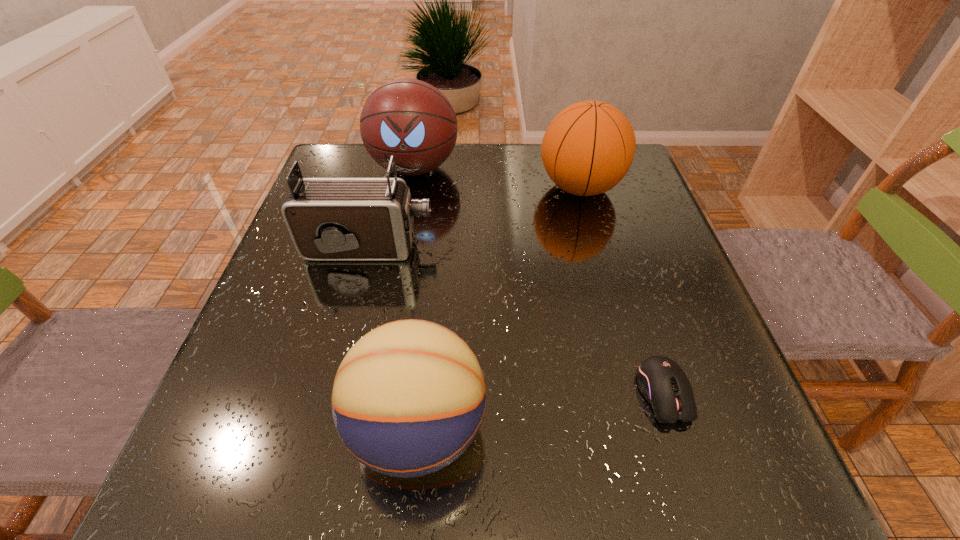
You are a GUI agent. You are given a task and a screenshot of the screen. Output one action in this format:
    pyautogui.click(x=<x>, y=<y>)
    Task: Click on the free spot between the rightmost basketball and the shortest object
    
    Given the screenshot: What is the action you would take?
    pyautogui.click(x=622, y=291)

Locate an element on the screen. free spot between the rightmost basketball and the computer mouse is located at coordinates (622, 291).

Where is `free space between the rightmost basketball and the nearest basketball`? The width and height of the screenshot is (960, 540). free space between the rightmost basketball and the nearest basketball is located at coordinates (499, 308).

Locate an element on the screen. The height and width of the screenshot is (540, 960). free spot between the rightmost basketball and the nearest basketball is located at coordinates (499, 308).

Identify which object is the third nearest to the nearest basketball. Please provide its 2D coordinates. Your answer should be formatted as a tuple, i.e. [(x, y)], where the tuple contains the x and y coordinates of a point satisfying the conditions above.

[(587, 149)]

Where is `the third closest object to the nearest basketball`? Image resolution: width=960 pixels, height=540 pixels. the third closest object to the nearest basketball is located at coordinates (587, 149).

Identify the location of basketball object that ranks as the third closest to the camcorder. (587, 149).

This screenshot has height=540, width=960. Find the location of `basketball that is the closest to the third farthest object`. basketball that is the closest to the third farthest object is located at coordinates (408, 118).

Locate an element on the screen. free location that satisfies the following two spatial constraints: 1. at the lens of the third farthest object; 2. on the right side of the shortest object is located at coordinates click(x=331, y=393).

At what (x,y) coordinates should I click in order to perform the action: click on vacant point that satisfies the following two spatial constraints: 1. at the lens of the third nearest object; 2. on the left side of the shortest object. Please return your answer as a coordinate pair (x, y). The width and height of the screenshot is (960, 540). Looking at the image, I should click on (331, 393).